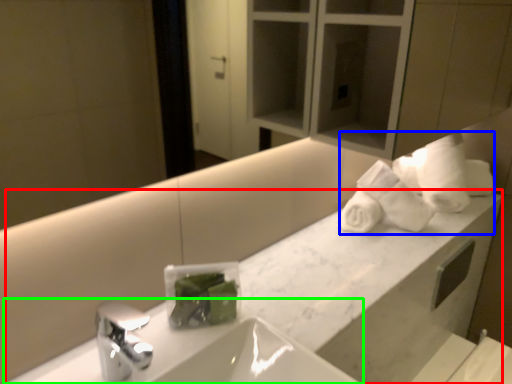
Question: Based on their relative distances, which object is farther from counter (highlighted by a red box)? Choose from bath towel (highlighted by a blue box) and sink (highlighted by a green box).

Choices:
 (A) bath towel
 (B) sink

Answer: (B)